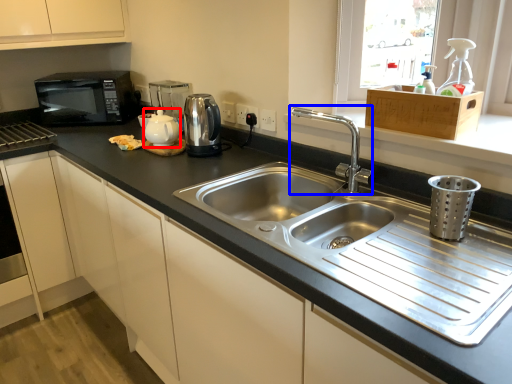
Question: Which point is further to the camera, tea pot (highlighted by a red box) or tap (highlighted by a blue box)?

Choices:
 (A) tea pot
 (B) tap

Answer: (A)